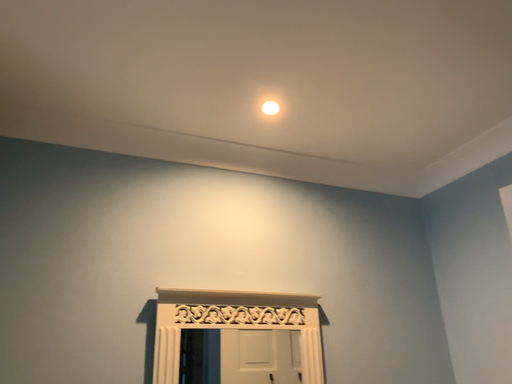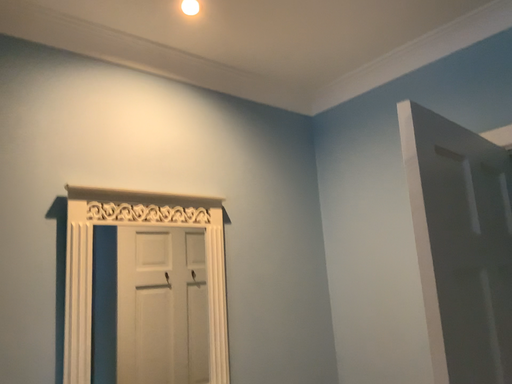
Question: How did the camera likely rotate when shooting the video?

Choices:
 (A) rotated left
 (B) rotated right

Answer: (B)